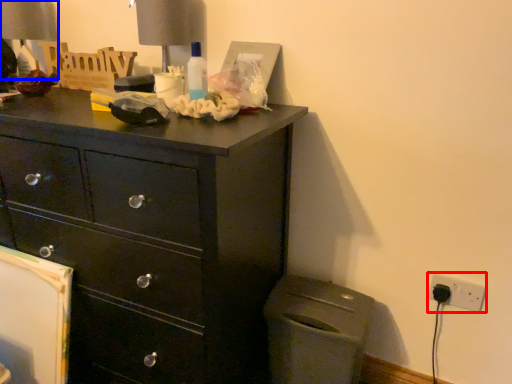
Question: Which of the following is the closest to the observer, electric outlet (highlighted by a red box) or table lamp (highlighted by a blue box)?

Choices:
 (A) electric outlet
 (B) table lamp

Answer: (A)